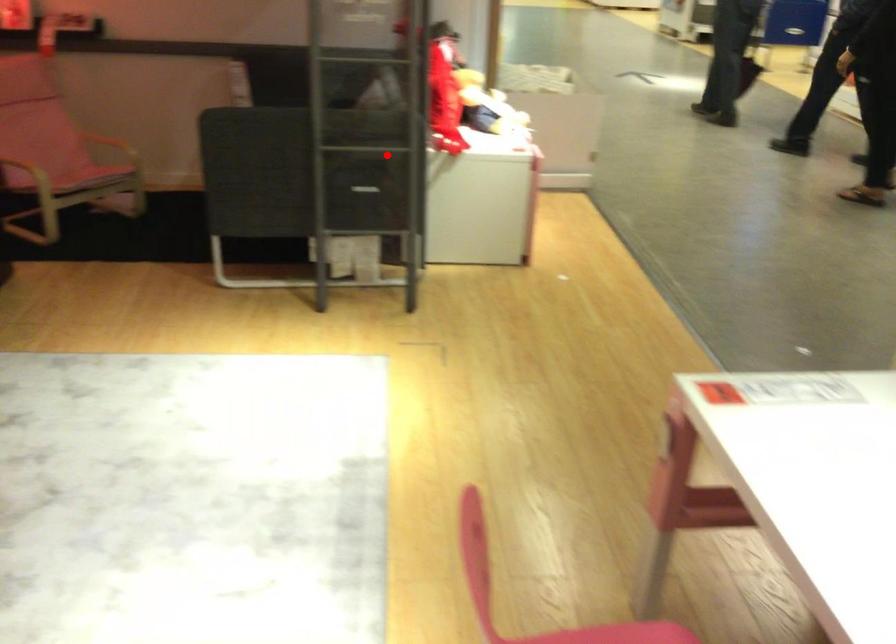
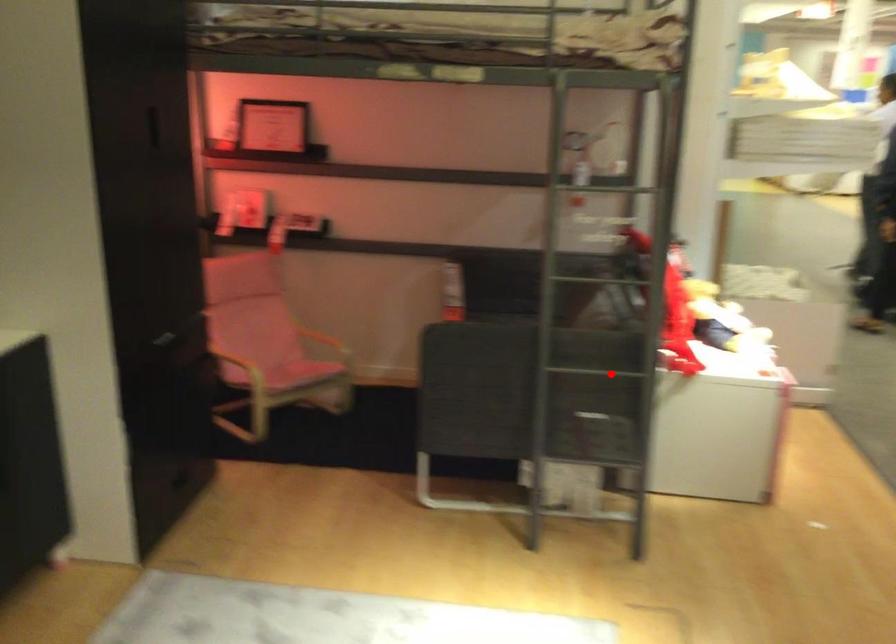
I am providing you with two images of the same scene from different viewpoints. A red point is marked on the first image and another point is marked on the second image. Do the highlighted points in image1 and image2 indicate the same real-world spot?

Yes